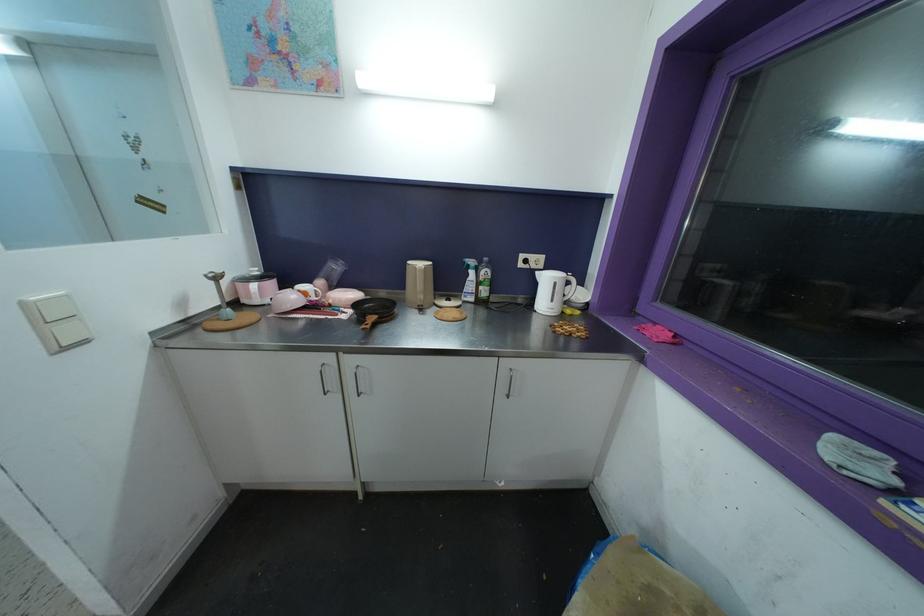
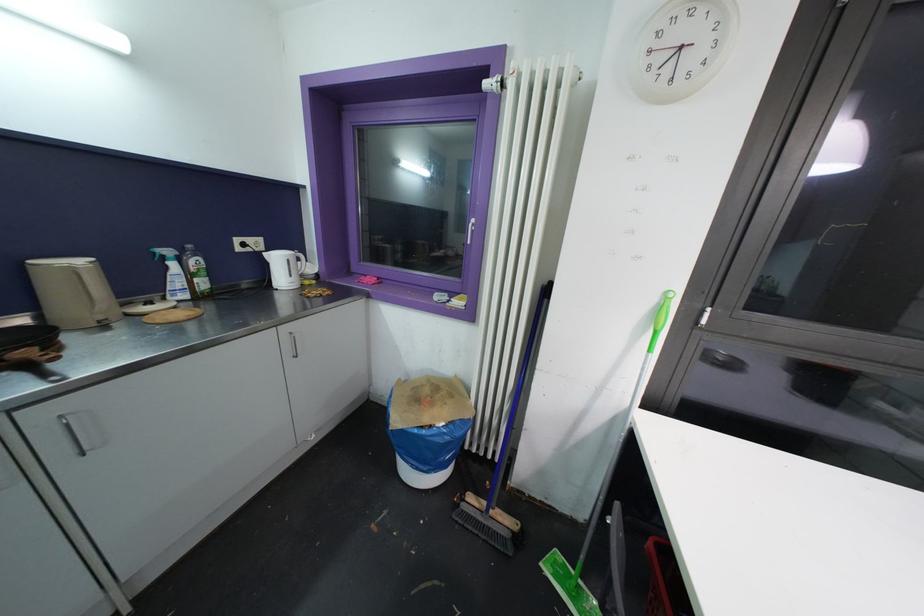
Where in the second image is the point corresponding to the point at 514,371 from the first image?

(294, 336)